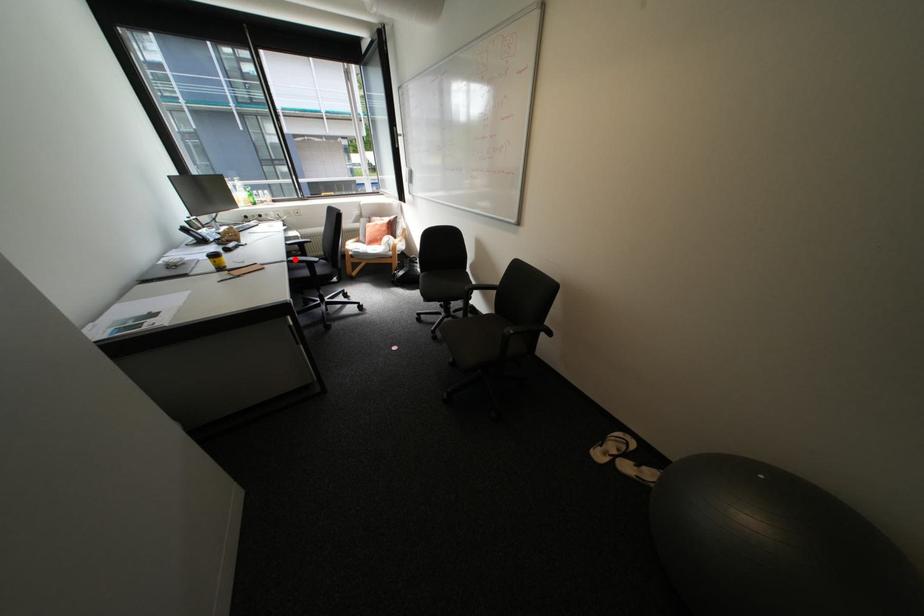
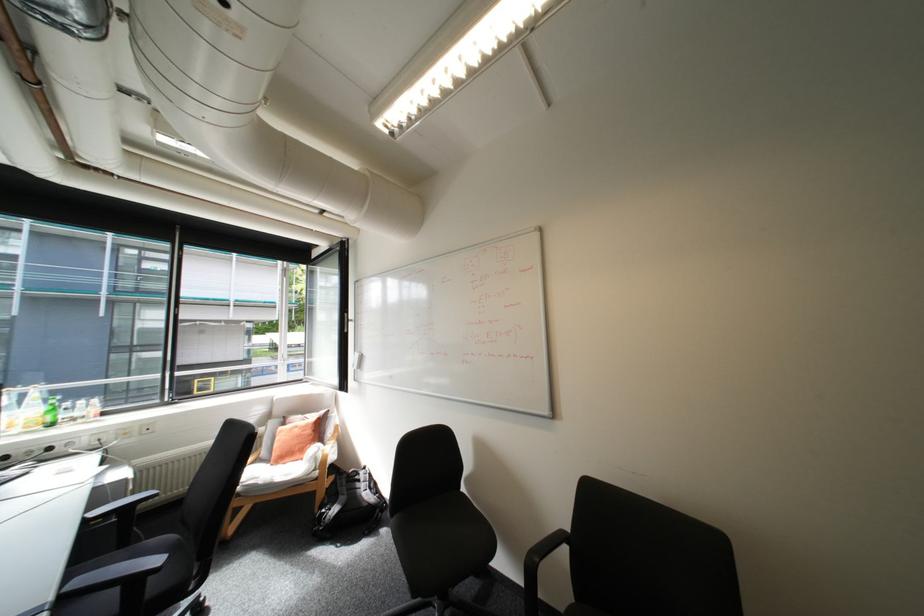
Where in the second image is the point corresponding to the highlighted location from the first image?

(61, 598)